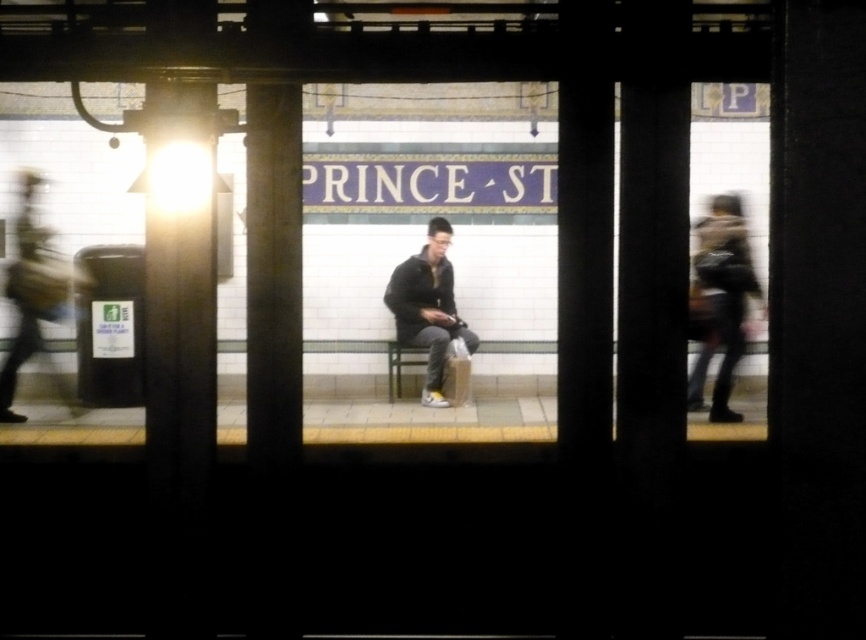
Is point (735, 211) behind point (395, 308)?

No, it is in front of (395, 308).

Between camouflage-patterned jacket at right and dark gray jacket at center, which one appears on the left side from the viewer's perspective?

Positioned to the left is dark gray jacket at center.

The height and width of the screenshot is (640, 866). What do you see at coordinates (721, 300) in the screenshot? I see `camouflage-patterned jacket at right` at bounding box center [721, 300].

The image size is (866, 640). I want to click on camouflage-patterned jacket at right, so [x=721, y=300].

Who is more forward, (x=157, y=100) or (x=244, y=280)?

Point (x=157, y=100)

Can you confirm if metallic column at left is taller than smooth concrete pillar at center?

Yes, metallic column at left is taller than smooth concrete pillar at center.

Is point (204, 266) positioned before point (276, 406)?

Yes, point (204, 266) is in front of point (276, 406).

The width and height of the screenshot is (866, 640). What are the coordinates of `metallic column at left` in the screenshot? It's located at (179, 284).

Is metallic column at left below camouflage-patterned jacket at right?

No.

Is metallic column at left taller than camouflage-patterned jacket at right?

Yes.

Find the location of a particular element. metallic column at left is located at coordinates (179, 284).